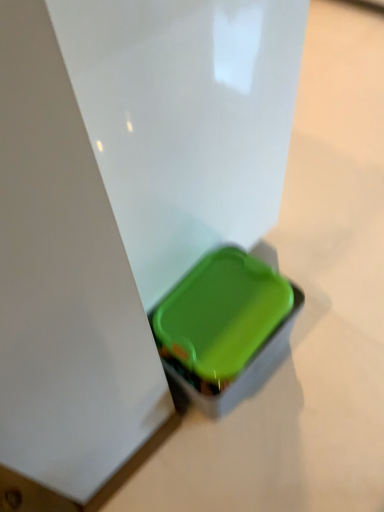
Locate an element on the screen. green plastic container at lower center is located at coordinates [x=225, y=327].

The height and width of the screenshot is (512, 384). Describe the element at coordinates (225, 327) in the screenshot. I see `green plastic container at lower center` at that location.

The image size is (384, 512). In order to click on green plastic container at lower center in this screenshot , I will do `click(225, 327)`.